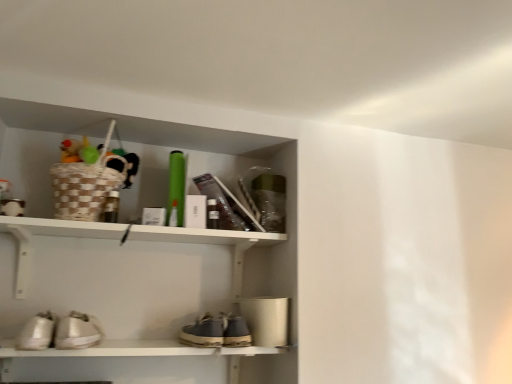
Question: In terms of width, does shiny metallic sneakers at lower left, which is the 1th footwear from right to left, look wider or thinner when compared to white leather sneakers at lower left, arranged as the first footwear when viewed from the left?

Choices:
 (A) wide
 (B) thin

Answer: (B)

Question: Considering the positions of point (74, 324) and point (18, 347), is point (74, 324) closer or farther from the camera than point (18, 347)?

Choices:
 (A) closer
 (B) farther

Answer: (B)

Question: Based on their relative distances, which object is nearer to the shiny metallic sneakers at lower left, placed as the 2th footwear when sorted from left to right?

Choices:
 (A) leather suede shoe at center
 (B) white leather sneakers at lower left, arranged as the first footwear when viewed from the left
 (C) white matte shelf at upper center

Answer: (B)

Question: Which object is positioned farthest from the shiny metallic sneakers at lower left, placed as the 2th footwear when sorted from left to right?

Choices:
 (A) white leather sneakers at lower left, positioned as the 2th footwear in right-to-left order
 (B) white matte shelf at upper center
 (C) leather suede shoe at center

Answer: (C)